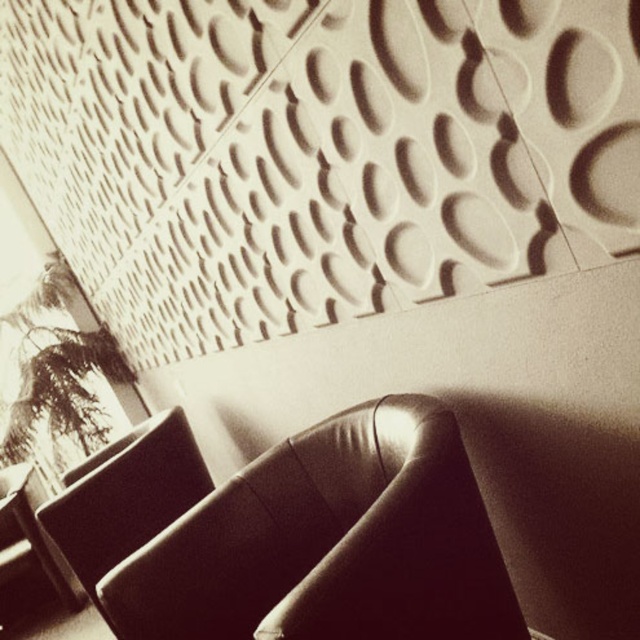
Question: Can you confirm if leather armchair at center is positioned below leather at left?

Choices:
 (A) no
 (B) yes

Answer: (A)

Question: Is leather armchair at center positioned in front of leather at left?

Choices:
 (A) yes
 (B) no

Answer: (A)

Question: Among these objects, which one is nearest to the camera?

Choices:
 (A) leather armchair at center
 (B) leather at left

Answer: (A)

Question: Which of the following is the closest to the observer?

Choices:
 (A) (83, 465)
 (B) (124, 579)

Answer: (B)

Question: Which point is farther from the camera taking this photo?

Choices:
 (A) (84, 547)
 (B) (280, 624)

Answer: (A)

Question: Is leather armchair at center below leather at left?

Choices:
 (A) no
 (B) yes

Answer: (A)